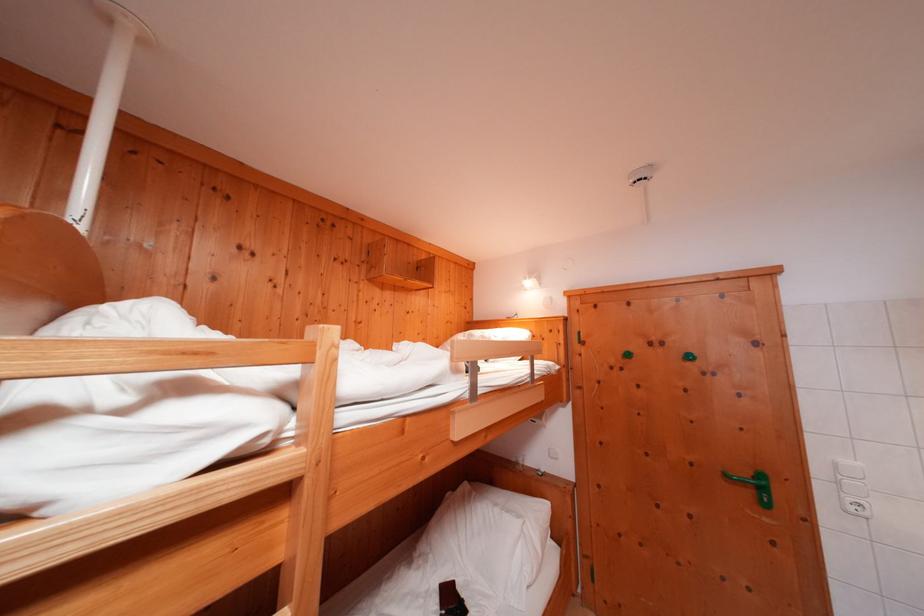
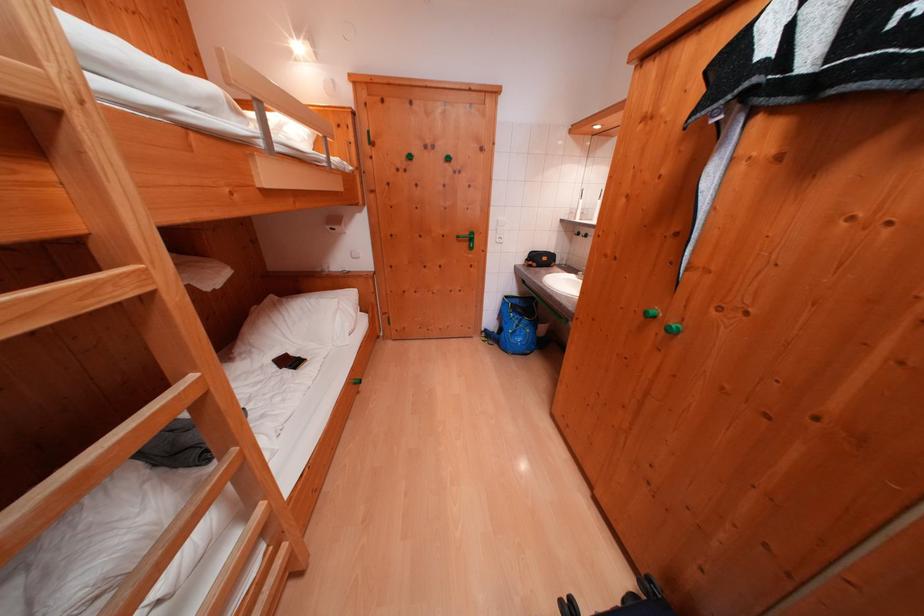
Locate, in the second image, the point that corresponds to (x=463, y=586) in the first image.

(295, 359)